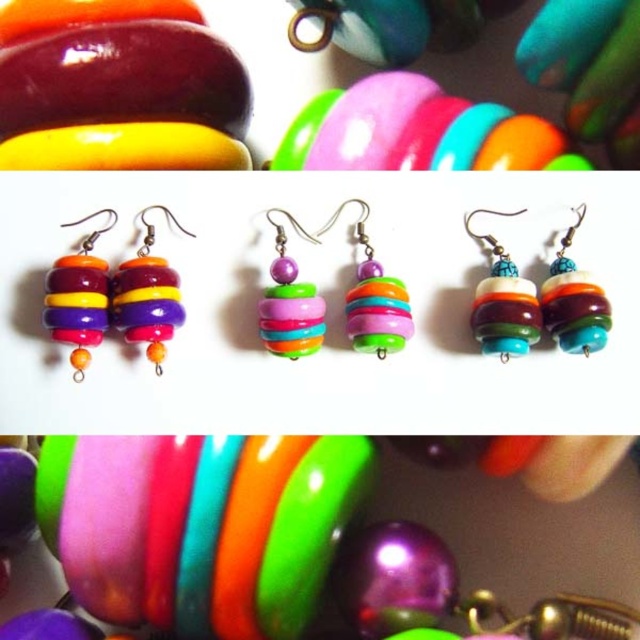
You are a jeweler examining the image and want to place a new bead between the two points, point (284, 444) and point (442, 166). Based on their positions, which point should the bead be closer to if it needs to be placed in front of the second point?

The bead should be placed closer to point (284, 444) because it is in front of point (442, 166).

You are a jeweler examining the image and want to know the arrangement of the bracelets. Is the glossy plastic bracelet at center located above or below the shiny plastic bracelet at upper center?

The glossy plastic bracelet at center is positioned under the shiny plastic bracelet at upper center, so it is located below it.

You are standing 3 feet away from the image. Is the point at coordinates point (168, 506) closer to you than the middle section of the image?

The distance of point (168, 506) from viewer is 3.51 feet, so since you are standing 3 feet away, the point is farther than your current position. Therefore, the point at coordinates point (168, 506) is not closer to you than the middle section of the image.